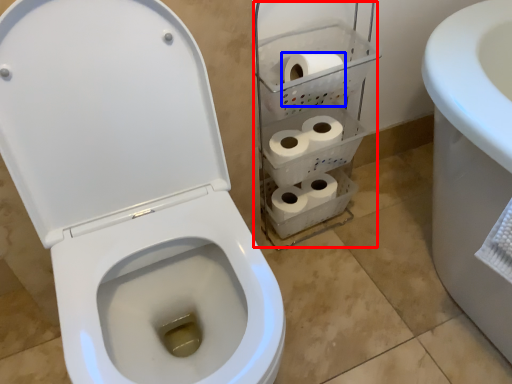
Question: Which object is further to the camera taking this photo, shelf (highlighted by a red box) or to paper (highlighted by a blue box)?

Choices:
 (A) shelf
 (B) to paper

Answer: (B)